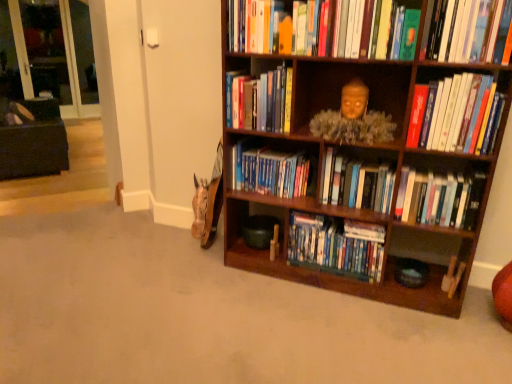
Find the location of `space that is in front of wooden bookcase at right`. space that is in front of wooden bookcase at right is located at coordinates (351, 332).